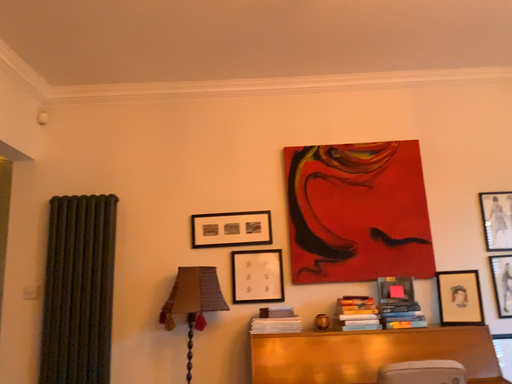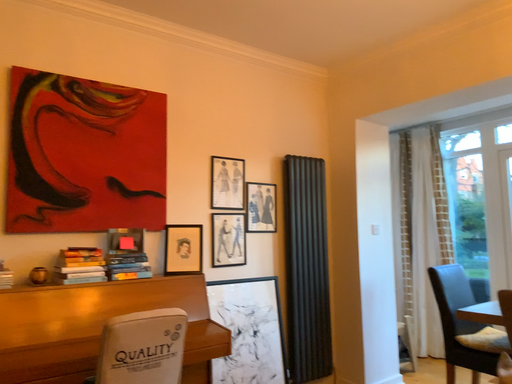
Question: How did the camera likely rotate when shooting the video?

Choices:
 (A) rotated left
 (B) rotated right

Answer: (B)